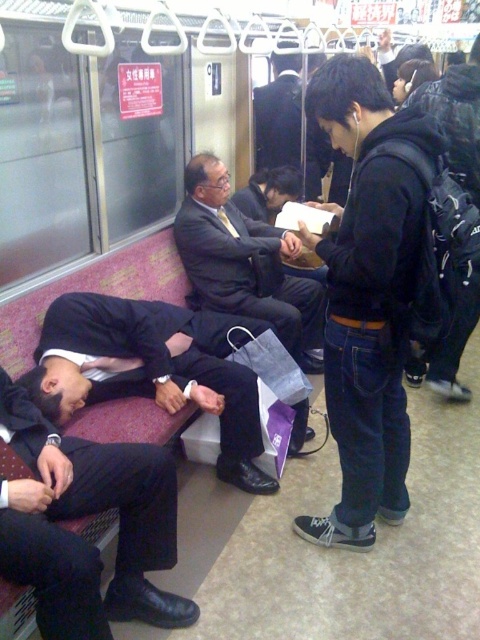
Can you confirm if black matte jacket at center is shorter than dark blue suit at center?

No.

The height and width of the screenshot is (640, 480). What do you see at coordinates (368, 296) in the screenshot?
I see `black matte jacket at center` at bounding box center [368, 296].

Where is `black matte jacket at center`? The height and width of the screenshot is (640, 480). black matte jacket at center is located at coordinates (368, 296).

Can you confirm if black matte jacket at center is wider than black suit at lower left?

In fact, black matte jacket at center might be narrower than black suit at lower left.

This screenshot has height=640, width=480. Find the location of `black matte jacket at center`. black matte jacket at center is located at coordinates [368, 296].

Who is positioned more to the right, black suit at lower left or matte black suit at center?

From the viewer's perspective, matte black suit at center appears more on the right side.

Does point (4, 401) lie in front of point (180, 205)?

Yes, it is.

Is point (74, 588) positioned in front of point (323, 310)?

Yes, it is in front of point (323, 310).

Where is `black suit at lower left`? The height and width of the screenshot is (640, 480). black suit at lower left is located at coordinates (83, 515).